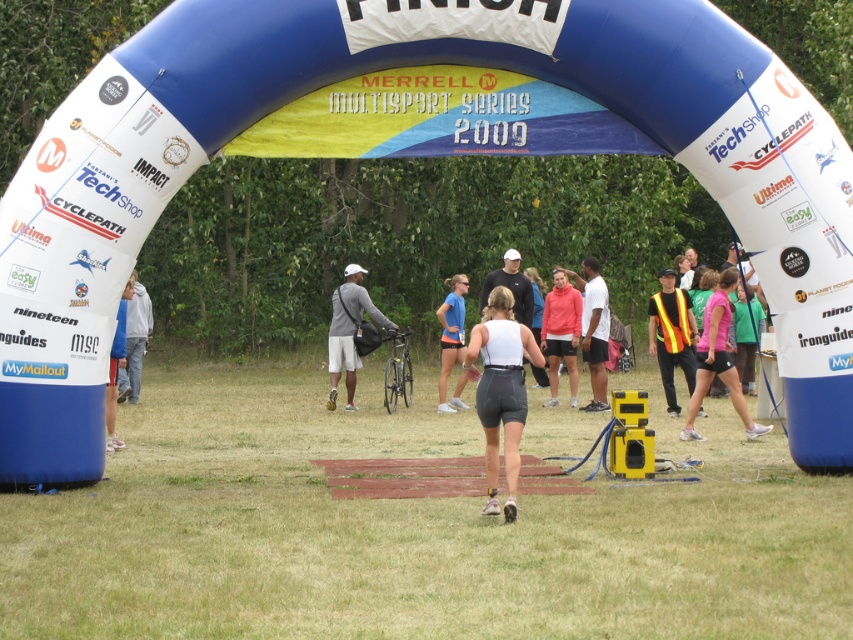
Question: Does matte pink hoodie at center appear on the right side of blue fabric jacket at left?

Choices:
 (A) no
 (B) yes

Answer: (B)

Question: Estimate the real-world distances between objects in this image. Which object is farther from the white matte tank top at center?

Choices:
 (A) reflective orange vest at center
 (B) matte pink hoodie at center

Answer: (B)

Question: Is reflective orange vest at center closer to camera compared to matte blue shorts at center?

Choices:
 (A) yes
 (B) no

Answer: (A)

Question: Among these points, which one is nearest to the camera?

Choices:
 (A) (653, 346)
 (B) (753, 432)
 (C) (486, 422)
 (D) (119, 346)

Answer: (C)

Question: Is pink fabric shorts at center wider than gray fabric jacket at left?

Choices:
 (A) no
 (B) yes

Answer: (B)

Question: Which of the following is the closest to the observer?

Choices:
 (A) reflective orange vest at center
 (B) white matte shirt at center
 (C) blue fabric jacket at left

Answer: (C)